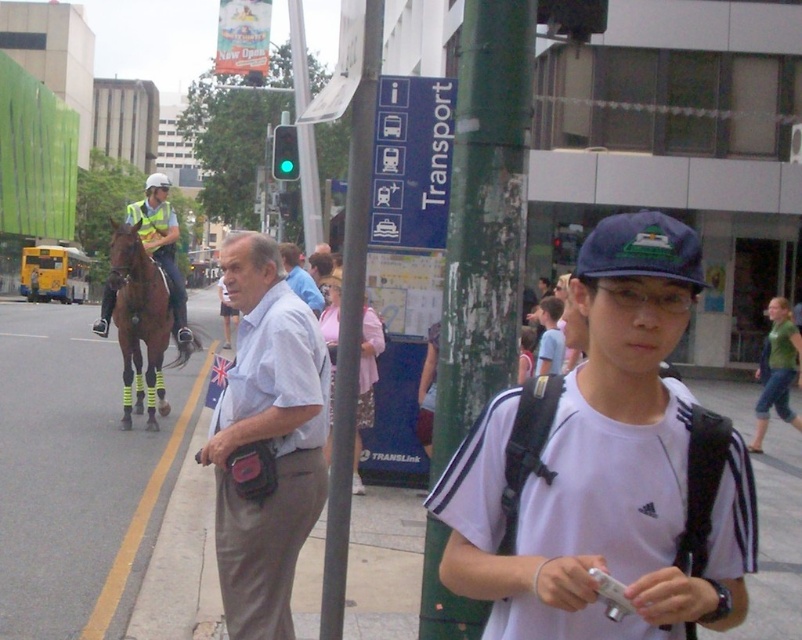
Question: Can you confirm if yellow asphalt at left is thinner than brown glossy horse at left?

Choices:
 (A) yes
 (B) no

Answer: (B)

Question: Which object appears farthest from the camera in this image?

Choices:
 (A) shiny brown horse at left
 (B) yellow asphalt at left
 (C) white matte shirt at center

Answer: (A)

Question: Is green painted metal pole at center bigger than blue plastic transport sign at upper center?

Choices:
 (A) no
 (B) yes

Answer: (B)

Question: Which object is positioned farthest from the light blue shirt at center?

Choices:
 (A) yellow asphalt at left
 (B) brown glossy horse at left
 (C) green fabric shirt at lower right

Answer: (A)

Question: Among these points, which one is farthest from the camera?

Choices:
 (A) [237, 246]
 (B) [527, 493]
 (C) [786, 394]
 (D) [114, 470]

Answer: (C)

Question: Is blue plastic transport sign at upper center to the left of shiny brown horse at left from the viewer's perspective?

Choices:
 (A) yes
 (B) no

Answer: (B)